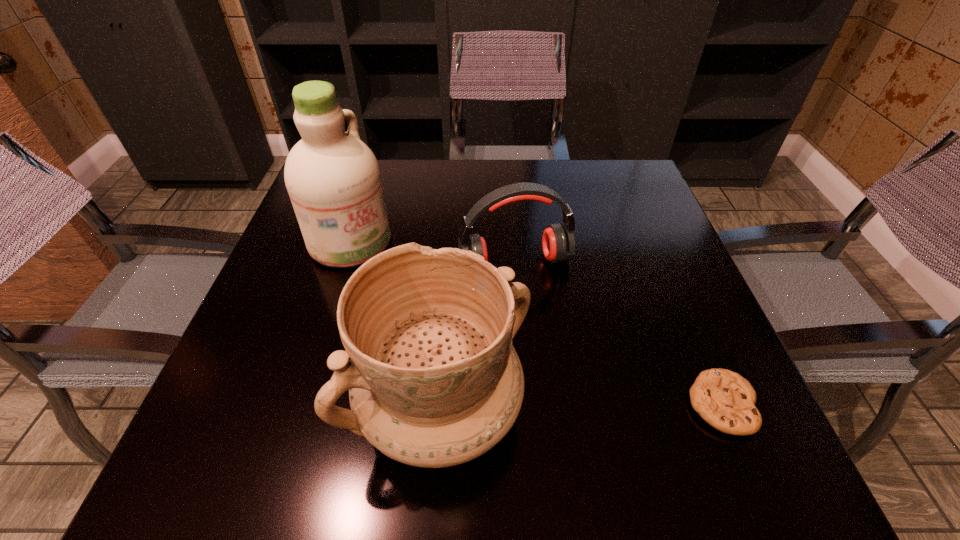
Locate an element on the screen. Image resolution: width=960 pixels, height=540 pixels. free space on the desktop that is between the third shortest object and the shortest object and is positioned on the front label of the leftmost object is located at coordinates (587, 406).

What are the coordinates of `free space on the desktop that is between the pottery and the cookie and is positioned on the ear cups of the earphone` in the screenshot? It's located at (569, 407).